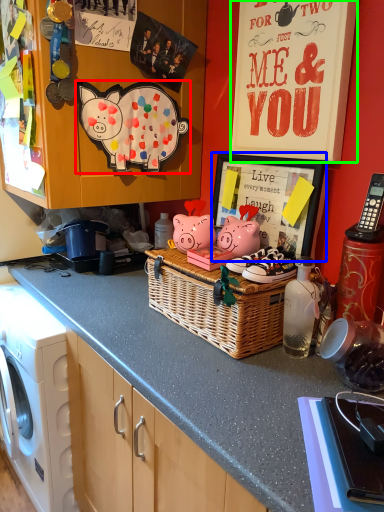
Question: Based on their relative distances, which object is nearer to pig (highlighted by a red box)? Choose from picture frame (highlighted by a blue box) and bulletin board (highlighted by a green box).

Choices:
 (A) picture frame
 (B) bulletin board

Answer: (A)